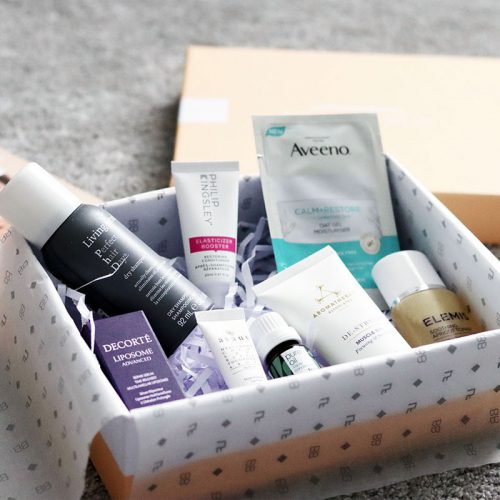
Where is `grey carpet lower right corner`? This screenshot has height=500, width=500. grey carpet lower right corner is located at coordinates (456, 481), (457, 485), (453, 492).